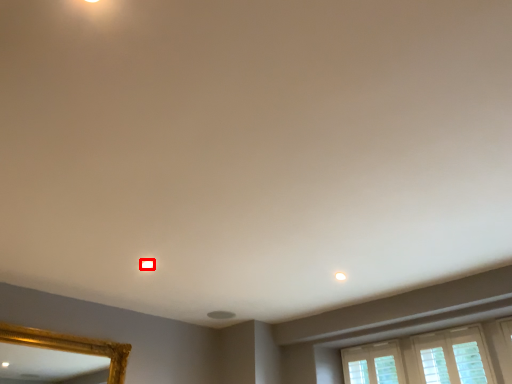
Question: From the image's perspective, considering the relative positions of lighting (annotated by the red box) and light in the image provided, where is lighting (annotated by the red box) located with respect to the staircase?

Choices:
 (A) above
 (B) below

Answer: (A)